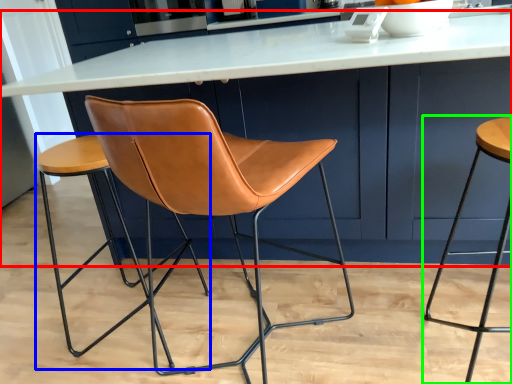
Question: Which object is the farthest from table (highlighted by a red box)? Choose among these: stool (highlighted by a blue box) or stool (highlighted by a green box).

Choices:
 (A) stool
 (B) stool

Answer: (B)